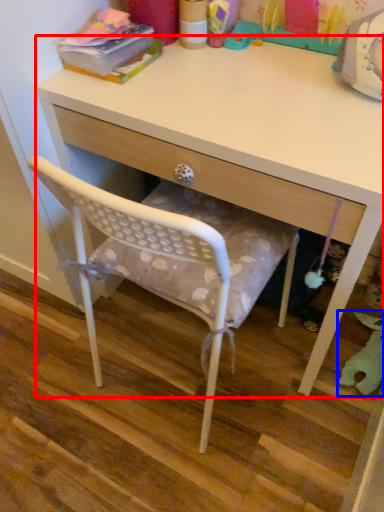
Question: Which of the following is the closest to the observer, desk (highlighted by a red box) or toy (highlighted by a blue box)?

Choices:
 (A) desk
 (B) toy

Answer: (A)